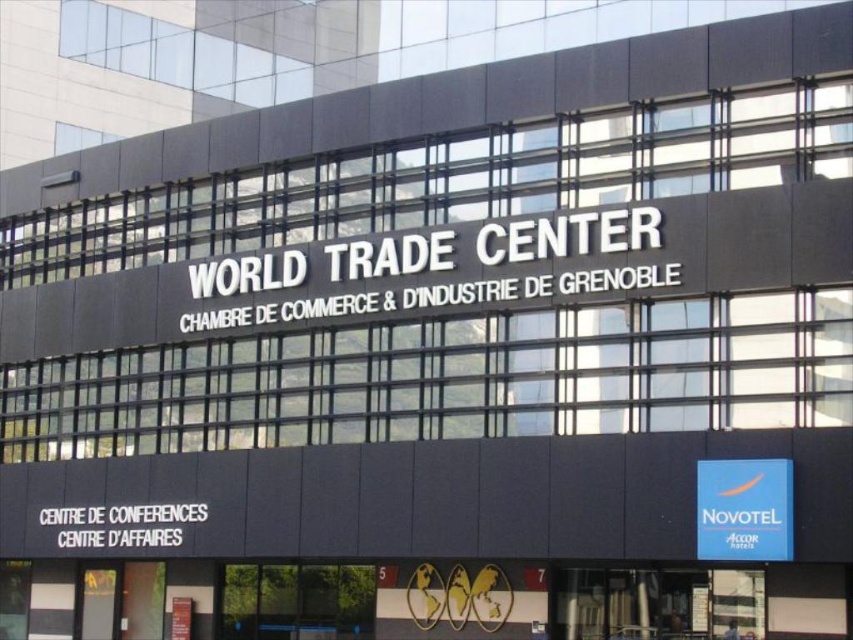
From the picture: Does white metallic sign at center have a lesser height compared to blue fabric sign at center?

No, white metallic sign at center is not shorter than blue fabric sign at center.

Based on the photo, can you confirm if white metallic sign at center is positioned below blue fabric sign at center?

No.

The width and height of the screenshot is (853, 640). I want to click on white metallic sign at center, so click(x=344, y=282).